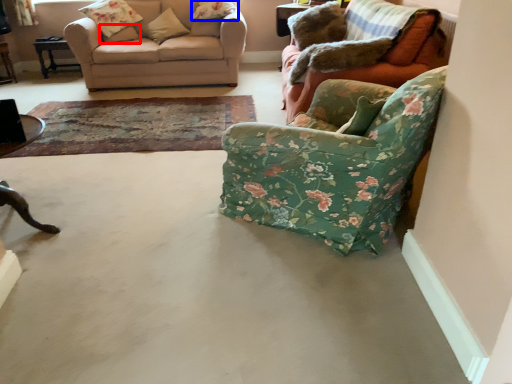
Question: Which object is closer to the camera taking this photo, pillow (highlighted by a red box) or pillow (highlighted by a blue box)?

Choices:
 (A) pillow
 (B) pillow

Answer: (B)